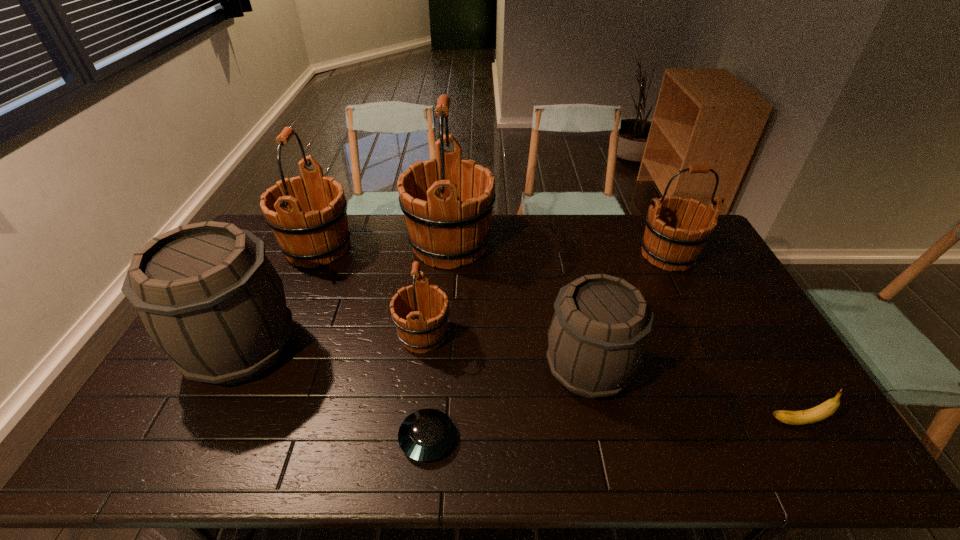
Select which object appears as the closest to the rightmost wood wine bucket. Please provide its 2D coordinates. Your answer should be formatted as a tuple, i.e. [(x, y)], where the tuple contains the x and y coordinates of a point satisfying the conditions above.

[(596, 339)]

Image resolution: width=960 pixels, height=540 pixels. Find the location of `object that stands as the third closest to the tallest wine bucket`. object that stands as the third closest to the tallest wine bucket is located at coordinates (596, 339).

Locate which wine bucket ranks third in proximity to the tallest object. Please provide its 2D coordinates. Your answer should be formatted as a tuple, i.e. [(x, y)], where the tuple contains the x and y coordinates of a point satisfying the conditions above.

[(596, 339)]

Locate which wine bucket ranks third in proximity to the biggest wood wine bucket. Please provide its 2D coordinates. Your answer should be formatted as a tuple, i.e. [(x, y)], where the tuple contains the x and y coordinates of a point satisfying the conditions above.

[(596, 339)]

The image size is (960, 540). I want to click on the fourth closest wood wine bucket to the left brown wine bucket, so click(x=667, y=242).

Locate which wood wine bucket ranks in proximity to the biggest wood wine bucket. Please provide its 2D coordinates. Your answer should be formatted as a tuple, i.e. [(x, y)], where the tuple contains the x and y coordinates of a point satisfying the conditions above.

[(420, 330)]